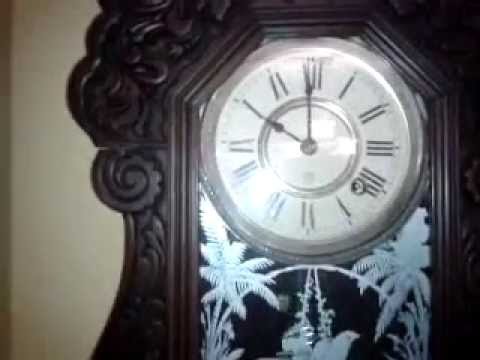
Where is `grandfather clock`? Image resolution: width=480 pixels, height=360 pixels. grandfather clock is located at coordinates (294, 231).